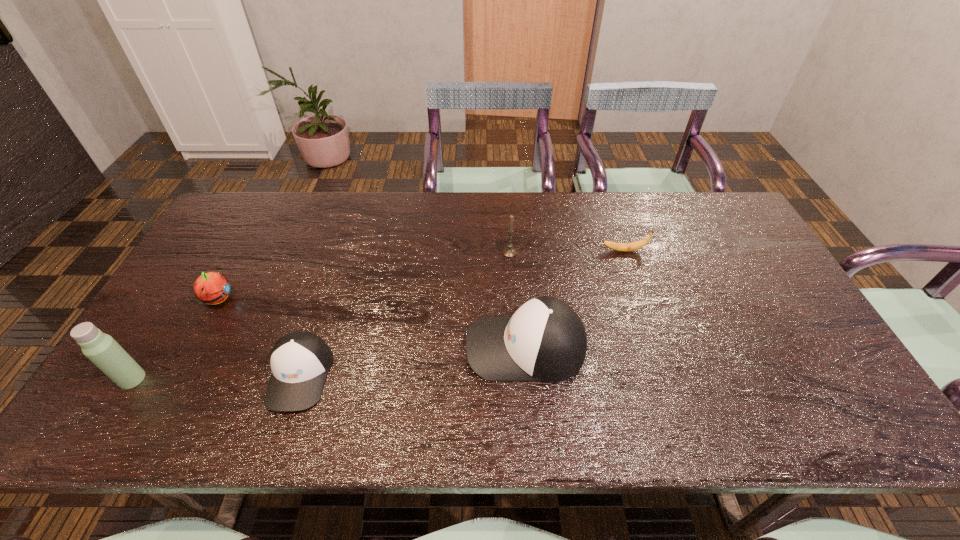
Where is `free space for a new cap on the right`? Image resolution: width=960 pixels, height=540 pixels. free space for a new cap on the right is located at coordinates (730, 322).